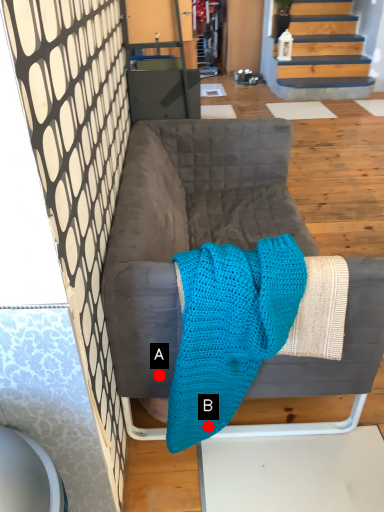
Question: Two points are circled on the image, labeled by A and B beside each circle. Which point is closer to the camera?

Choices:
 (A) A is closer
 (B) B is closer

Answer: (A)